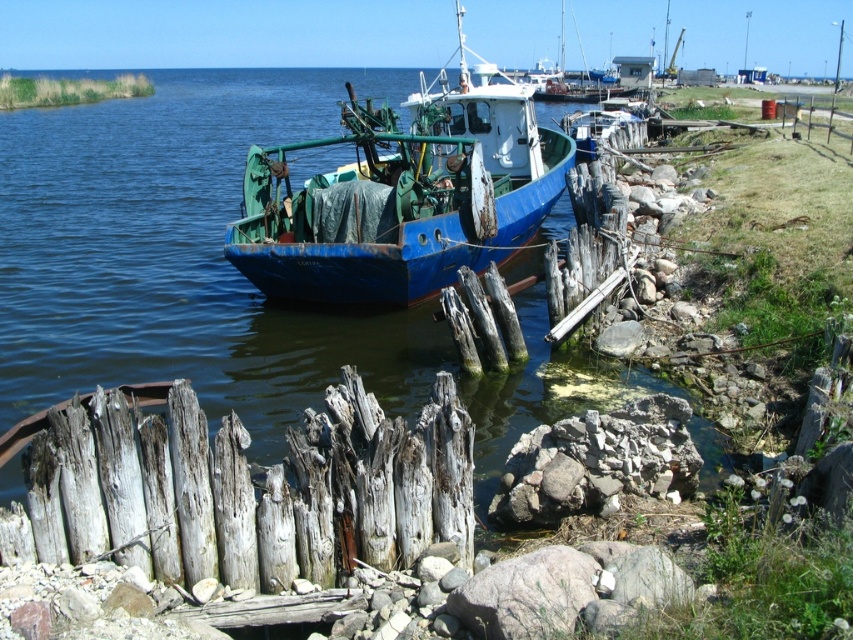
You are a delivery drone carrying a package that requires a landing zone at least 5 meters wide. You need to land between the weathered wood fence at lower left and the blue matte boat at center. Can you safely land there?

The distance between the weathered wood fence at lower left and the blue matte boat at center is 6.57 meters, which is wider than the required 5 meters. Therefore, the drone can safely land in that space.

You are standing on the wooden pier and want to move towards the fishing boat. There are two points marked on the pier at coordinates point (276, 476) and point (361, 280). Which point should you step on first to get closer to the boat?

You should step on point (276, 476) first because it is closer to the viewer than point (361, 280), so stepping on it first will bring you closer to the boat.

You are standing on the wooden pier and see a weathered wood fence at lower left. There is a point at coordinates (244,490). Is this point located on the weathered wood fence at lower left?

Yes, the point at coordinates (244,490) is located on the weathered wood fence at lower left.